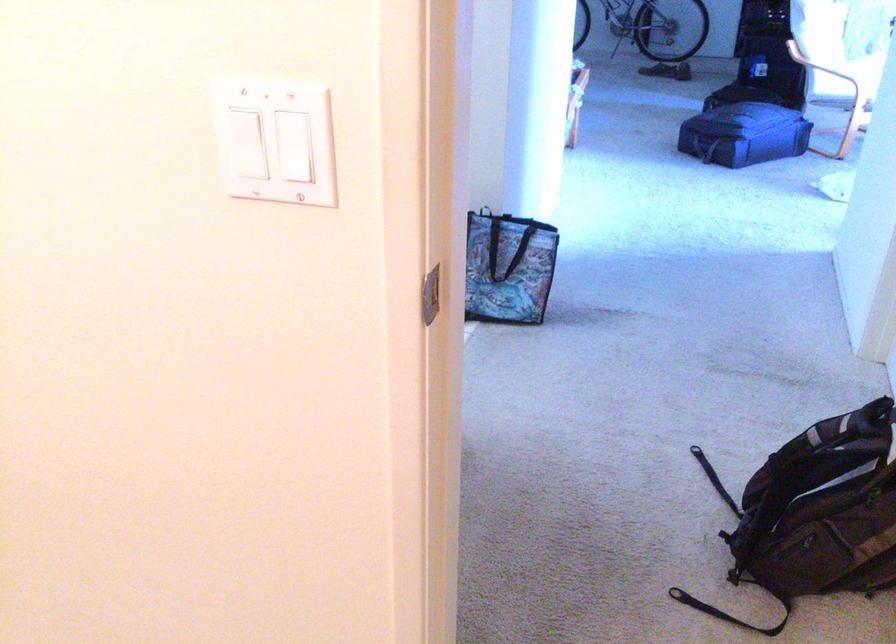
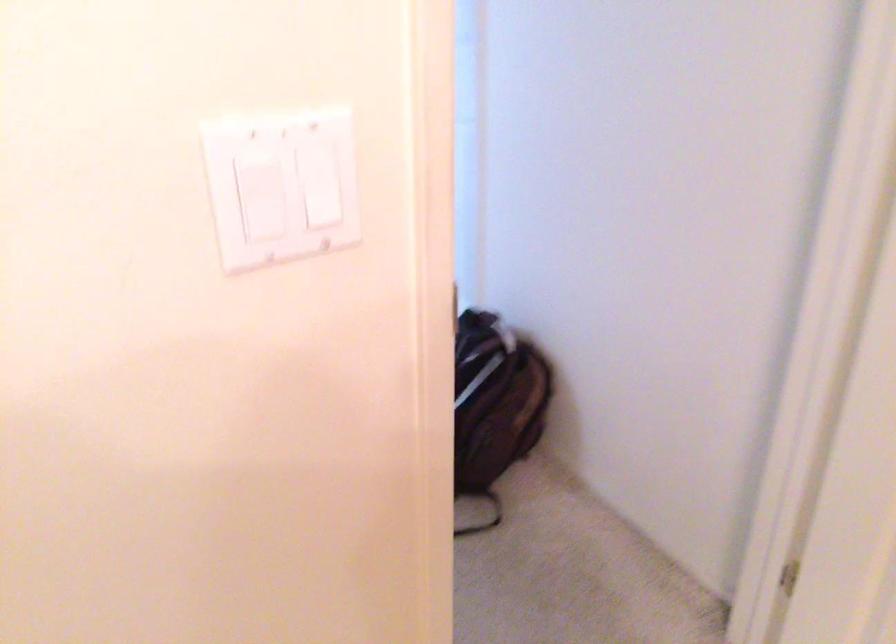
Question: I am providing you with two images of the same scene from different viewpoints. Please identify which objects are invisible in image2.

Choices:
 (A) black backpack strap
 (B) clear storage container
 (C) white light switch
 (D) brown backpack

Answer: (A)